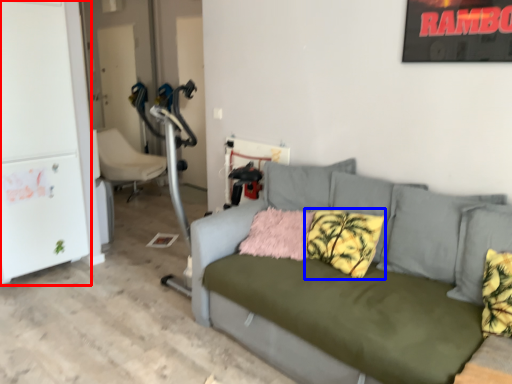
Question: Among these objects, which one is nearest to the camera, fridge (highlighted by a red box) or pillow (highlighted by a blue box)?

Choices:
 (A) fridge
 (B) pillow

Answer: (B)